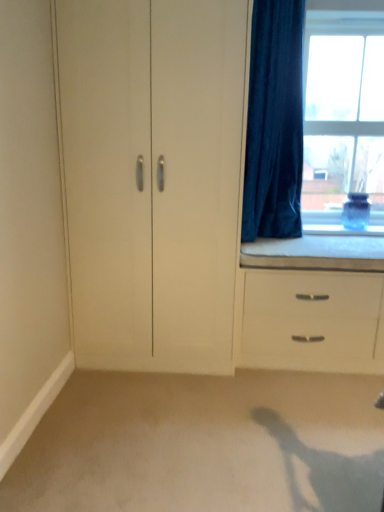
The height and width of the screenshot is (512, 384). I want to click on free spot below velvet dark blue curtain at right (from a real-world perspective), so click(x=287, y=236).